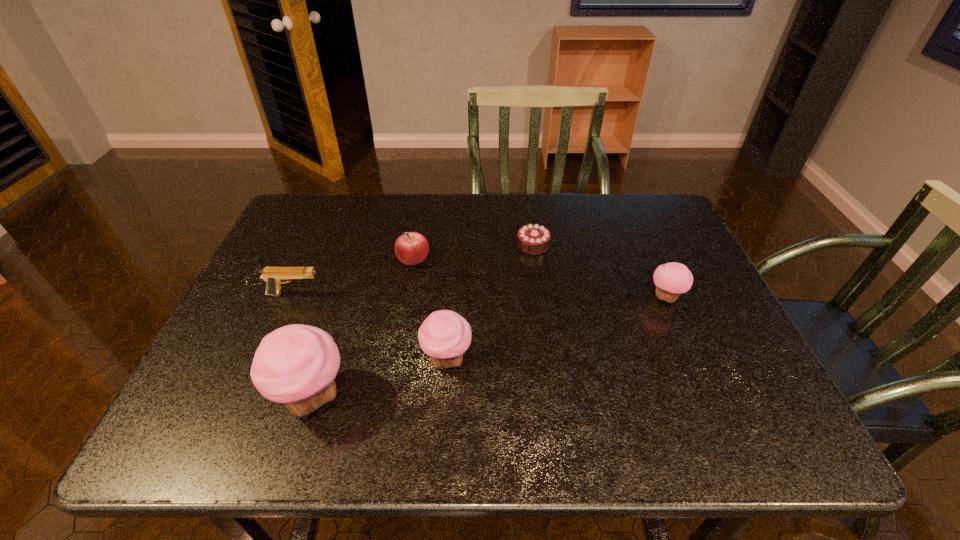
Where is `vacant spot for a new cupcake to ensure equal spacing`? The width and height of the screenshot is (960, 540). vacant spot for a new cupcake to ensure equal spacing is located at coordinates 564,326.